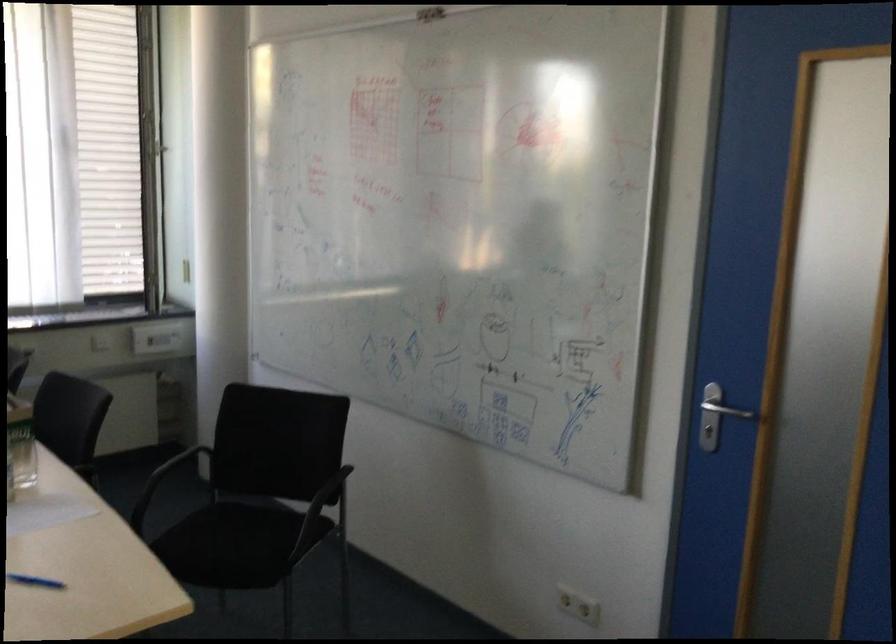
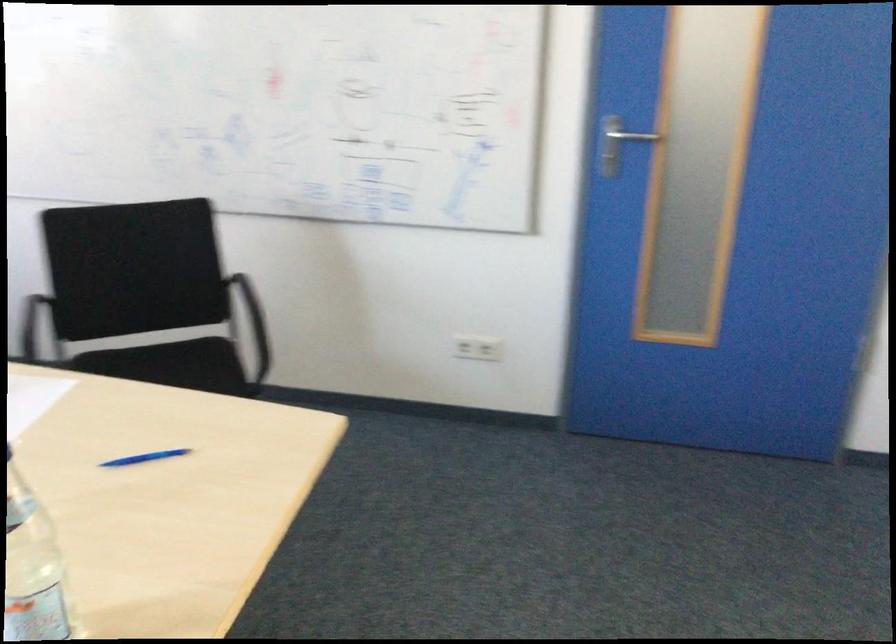
The point at [721,415] is marked in the first image. Where is the corresponding point in the second image?

(616, 144)